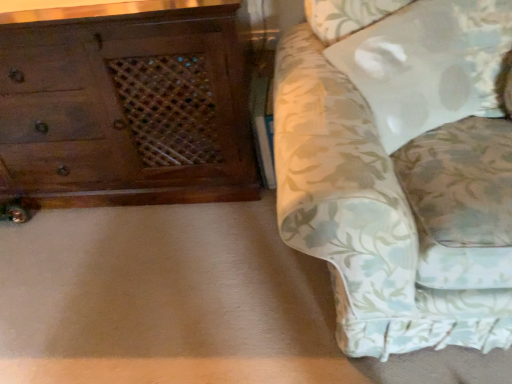
Question: Based on their sizes in the image, would you say white fabric pillow at upper right is bigger or smaller than floral fabric couch at right?

Choices:
 (A) small
 (B) big

Answer: (A)

Question: Looking at their shapes, would you say white fabric pillow at upper right is wider or thinner than floral fabric couch at right?

Choices:
 (A) wide
 (B) thin

Answer: (B)

Question: Which object is the farthest from the wooden chest of drawers at left?

Choices:
 (A) white fabric pillow at upper right
 (B) floral fabric couch at right

Answer: (A)

Question: Which of these objects is positioned farthest from the floral fabric couch at right?

Choices:
 (A) wooden chest of drawers at left
 (B) white fabric pillow at upper right

Answer: (A)